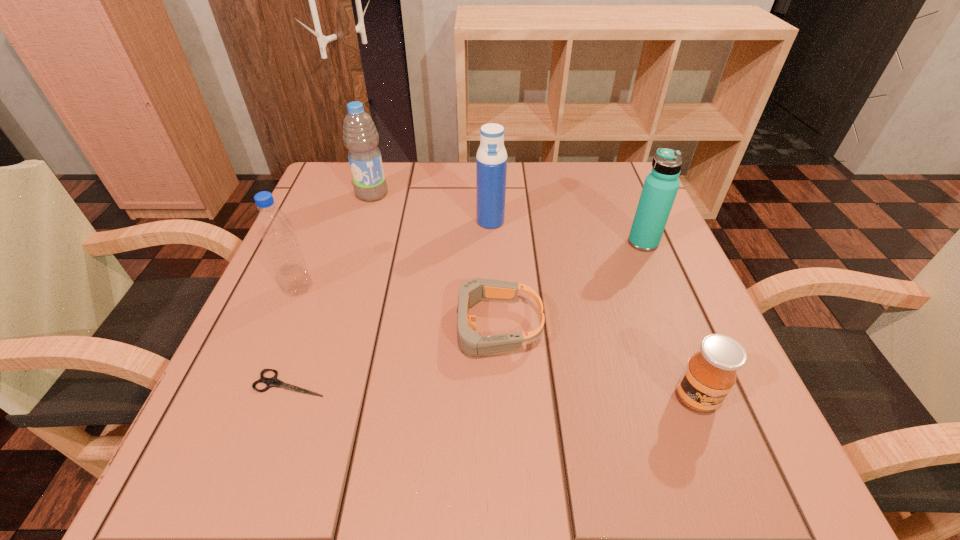
The width and height of the screenshot is (960, 540). Identify the location of free space located on the front of the farthest water bottle. (357, 242).

This screenshot has height=540, width=960. In order to click on vacant space situated on the right of the second farthest object in this screenshot , I will do `click(532, 221)`.

The width and height of the screenshot is (960, 540). What are the coordinates of `blank space located on the left of the fifth nearest object` in the screenshot? It's located at (441, 242).

Identify the location of free spot located 0.100m on the front of the nearest water bottle. (276, 343).

Where is `vacant area situated on the front-facing side of the third shortest object`? vacant area situated on the front-facing side of the third shortest object is located at coordinates (732, 489).

At what (x,y) coordinates should I click in order to perform the action: click on free spot located 0.230m on the front and back of the goggles. Please return your answer as a coordinate pair (x, y). The width and height of the screenshot is (960, 540). Looking at the image, I should click on (310, 326).

This screenshot has width=960, height=540. I want to click on blank space located 0.310m on the front and back of the goggles, so 264,326.

You are a GUI agent. You are given a task and a screenshot of the screen. Output one action in this format:
    pyautogui.click(x=<x>, y=<y>)
    Task: Click on the free space located 0.110m on the front and back of the goggles
    This screenshot has height=540, width=960.
    Given the screenshot: What is the action you would take?
    pyautogui.click(x=380, y=326)

Locate an element on the screen. vacant space located 0.150m on the back of the shears is located at coordinates (321, 300).

What are the coordinates of `shears at the left edge` in the screenshot? It's located at (273, 381).